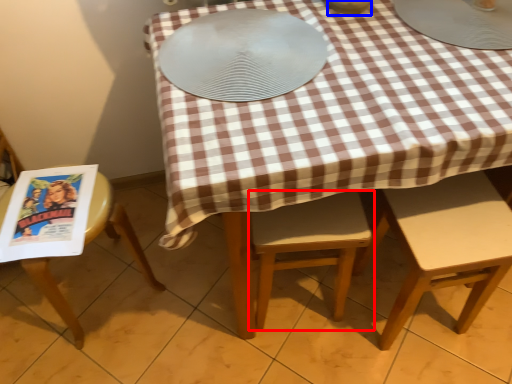
Question: Which point is closer to the camera, chair (highlighted by a red box) or tableware (highlighted by a blue box)?

Choices:
 (A) chair
 (B) tableware

Answer: (B)